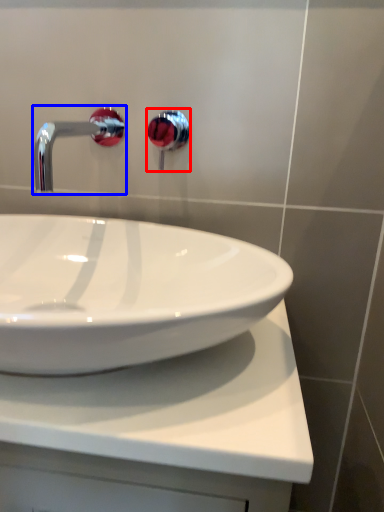
Question: Which point is closer to the camera, plumbing fixture (highlighted by a red box) or tap (highlighted by a blue box)?

Choices:
 (A) plumbing fixture
 (B) tap

Answer: (B)